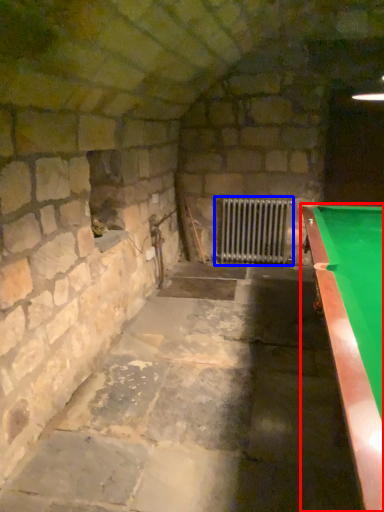
Question: Among these objects, which one is nearest to the camera, billiard table (highlighted by a red box) or radiator (highlighted by a blue box)?

Choices:
 (A) billiard table
 (B) radiator

Answer: (A)